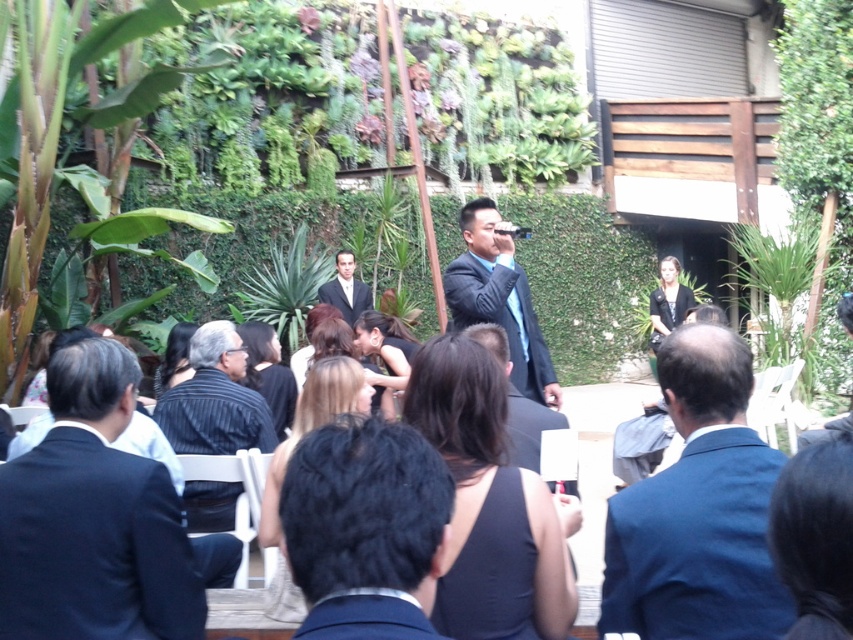
Who is lower down, blue suit at center or shiny black suit at center?

blue suit at center is lower down.

Does point (656, 627) come farther from viewer compared to point (520, 330)?

That is False.

You are a GUI agent. You are given a task and a screenshot of the screen. Output one action in this format:
    pyautogui.click(x=<x>, y=<y>)
    Task: Click on the blue suit at center
    The image size is (853, 640).
    Given the screenshot: What is the action you would take?
    pyautogui.click(x=698, y=509)

Locate an element on the screen. This screenshot has width=853, height=640. blue suit at center is located at coordinates (698, 509).

Between green leafy plant at right and striped fabric shirt at center, which one appears on the right side from the viewer's perspective?

Positioned to the right is green leafy plant at right.

Which of these two, green leafy plant at right or striped fabric shirt at center, stands shorter?

striped fabric shirt at center is shorter.

Is point (817, 355) positioned before point (241, 339)?

No.

The image size is (853, 640). I want to click on green leafy plant at right, so click(782, 289).

Does green leafy plant at right have a greater height compared to black satin dress at center?

Yes, green leafy plant at right is taller than black satin dress at center.

Which is above, green leafy plant at right or black satin dress at center?

green leafy plant at right is higher up.

Between point (828, 268) and point (409, 337), which one is positioned behind?

The point (828, 268) is behind.

The image size is (853, 640). Find the location of `green leafy plant at right`. green leafy plant at right is located at coordinates (782, 289).